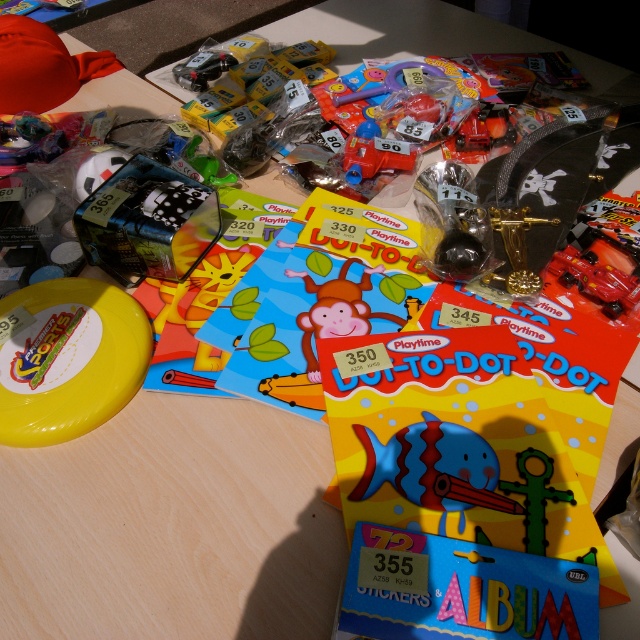
Does point (445, 422) come closer to viewer compared to point (545, 288)?

Yes, it is in front of point (545, 288).

Is matte plastic fish at center further to camera compared to shiny red car at center?

No, it is not.

Identify the location of matte plastic fish at center. (435, 468).

Which is below, matte plastic fish at center or green plastic sword at center?

green plastic sword at center is below.

Who is shorter, matte plastic fish at center or green plastic sword at center?

green plastic sword at center

Which is behind, point (365, 452) or point (529, 504)?

Point (365, 452)

Find the location of a particular element. This screenshot has height=640, width=640. matte plastic fish at center is located at coordinates (435, 468).

Is matte yellow frisbee at center shorter than translucent plastic toy car at center?

No.

Can you confirm if matte yellow frisbee at center is wider than translucent plastic toy car at center?

Yes.

Who is more distant from viewer, (337, 289) or (364, 168)?

The point (364, 168) is more distant.

Locate an element on the screen. matte yellow frisbee at center is located at coordinates pos(337,310).